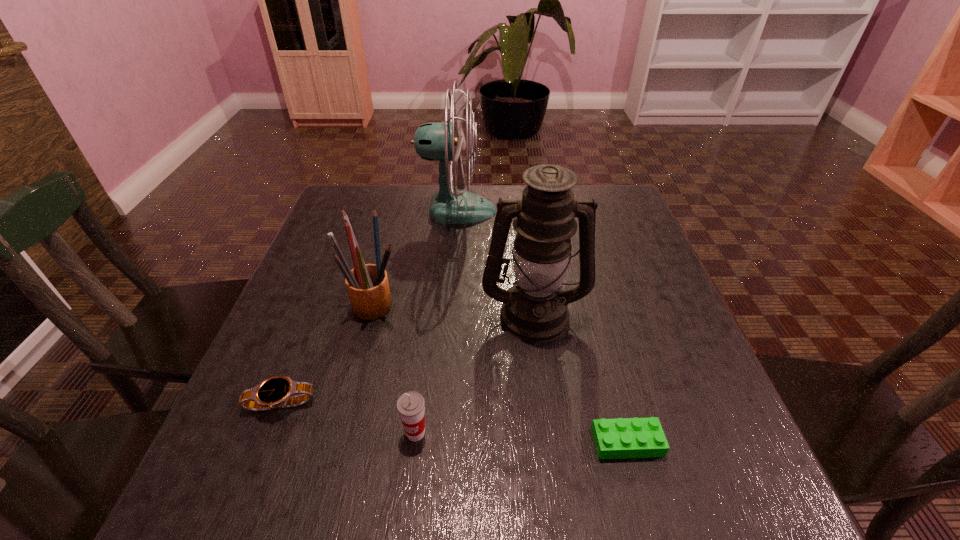
This screenshot has width=960, height=540. I want to click on vacant space situated on the front of the third nearest object, so click(255, 468).

This screenshot has width=960, height=540. Find the location of `free location located 0.080m on the left of the Lego`. free location located 0.080m on the left of the Lego is located at coordinates 543,442.

You are a GUI agent. You are given a task and a screenshot of the screen. Output one action in this format:
    pyautogui.click(x=<x>, y=<y>)
    Task: Click on the object at the far edge
    The image size is (960, 540).
    Given the screenshot: What is the action you would take?
    pyautogui.click(x=433, y=141)

The width and height of the screenshot is (960, 540). In order to click on pencil box positioned at the left edge in this screenshot , I will do `click(367, 284)`.

In order to click on watch that is at the left edge in this screenshot , I will do `click(272, 393)`.

In order to click on object situated at the right edge in this screenshot , I will do `click(620, 438)`.

Find the location of a particular element. The height and width of the screenshot is (540, 960). vacant space at the far edge of the desktop is located at coordinates (413, 224).

Find the location of a particular element. vacant space at the near edge of the desktop is located at coordinates (440, 479).

You are a GUI agent. You are given a task and a screenshot of the screen. Output one action in this format:
    pyautogui.click(x=<x>, y=<y>)
    Task: Click on the free spot at the left edge of the desktop
    
    Given the screenshot: What is the action you would take?
    pyautogui.click(x=316, y=246)

The width and height of the screenshot is (960, 540). Identify the location of vacant region at the right edge. (632, 375).